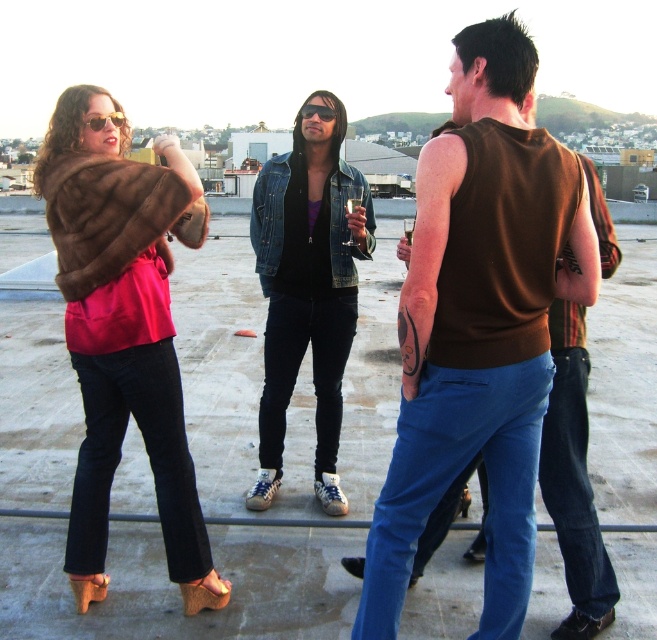
Question: Does brown sleeveless shirt at center appear under brown fur coat at left?

Choices:
 (A) yes
 (B) no

Answer: (A)

Question: Which of the following is the closest to the observer?

Choices:
 (A) matte brown fur coat at left
 (B) brown sleeveless shirt at center
 (C) black matte sunglasses at center

Answer: (B)

Question: Estimate the real-world distances between objects in this image. Which object is closer to the matte brown fur coat at left?

Choices:
 (A) denim jacket at center
 (B) brown fur coat at left
 (C) brown sleeveless shirt at center

Answer: (B)

Question: Does brown sleeveless shirt at center appear on the right side of denim jacket at center?

Choices:
 (A) no
 (B) yes

Answer: (B)

Question: Which point is farther to the camera?

Choices:
 (A) matte brown sunglasses at upper left
 (B) black matte sunglasses at center
 (C) brown sleeveless shirt at center
 (D) brown fur coat at left

Answer: (B)

Question: Considering the relative positions of denim jacket at center and black matte sunglasses at center in the image provided, where is denim jacket at center located with respect to black matte sunglasses at center?

Choices:
 (A) above
 (B) below

Answer: (B)